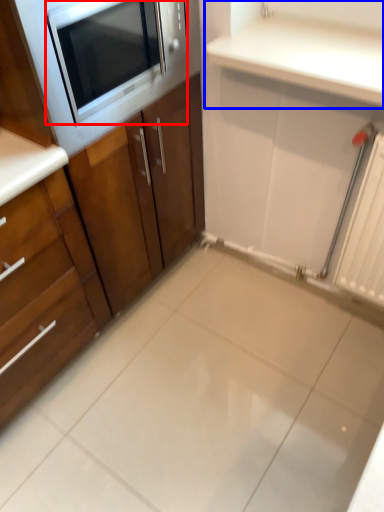
Question: Which point is further to the camera, microwave oven (highlighted by a red box) or countertop (highlighted by a blue box)?

Choices:
 (A) microwave oven
 (B) countertop

Answer: (B)